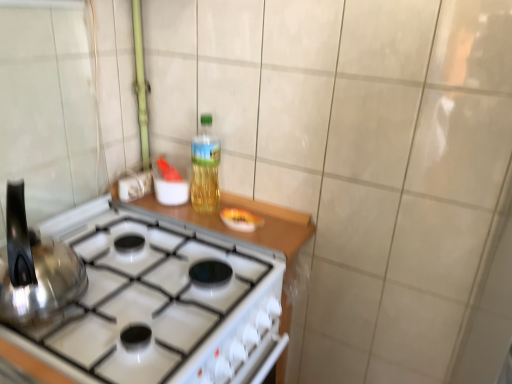
At what (x,y) coordinates should I click in order to perform the action: click on white glossy gas stove at center. Please return your answer as a coordinate pair (x, y). Image resolution: width=512 pixels, height=384 pixels. Looking at the image, I should click on (162, 309).

Locate an element on the screen. Image resolution: width=512 pixels, height=384 pixels. gas stove below the translucent plastic bottle at center (from the image's perspective) is located at coordinates 162,309.

How different are the orientations of translucent plastic bottle at center and white glossy gas stove at center in degrees?

translucent plastic bottle at center and white glossy gas stove at center are facing 2.04 degrees away from each other.

Which object is wider, translucent plastic bottle at center or white glossy gas stove at center?

Wider between the two is white glossy gas stove at center.

Measure the distance between translucent plastic bottle at center and white glossy gas stove at center.

translucent plastic bottle at center and white glossy gas stove at center are 13.06 inches apart.

Is satin silver kettle at left oriented towards translucent plastic bottle at center?

No, satin silver kettle at left is not oriented towards translucent plastic bottle at center.

How far apart are satin silver kettle at left and translucent plastic bottle at center?

satin silver kettle at left is 18.23 inches away from translucent plastic bottle at center.

Considering the relative sizes of satin silver kettle at left and translucent plastic bottle at center in the image provided, is satin silver kettle at left taller than translucent plastic bottle at center?

No.

From the image's perspective, which object appears higher, satin silver kettle at left or translucent plastic bottle at center?

From the image's view, translucent plastic bottle at center is above.

Based on the photo, are white glossy gas stove at center and translucent plastic bottle at center making contact?

No, white glossy gas stove at center is not beside translucent plastic bottle at center.

From the image's perspective, would you say white glossy gas stove at center is positioned over translucent plastic bottle at center?

No.

Is white glossy gas stove at center in front of translucent plastic bottle at center?

Yes, white glossy gas stove at center is closer to the camera.

Considering the sizes of objects white glossy gas stove at center and translucent plastic bottle at center in the image provided, who is thinner, white glossy gas stove at center or translucent plastic bottle at center?

With smaller width is translucent plastic bottle at center.

Looking at this image, is translucent plastic bottle at center not within satin silver kettle at left?

That's correct, translucent plastic bottle at center is outside of satin silver kettle at left.

Considering the points (192, 198) and (61, 245), which point is behind, point (192, 198) or point (61, 245)?

Point (192, 198)

Is translucent plastic bottle at center thinner than satin silver kettle at left?

Indeed, translucent plastic bottle at center has a lesser width compared to satin silver kettle at left.

Considering the sizes of objects translucent plastic bottle at center and satin silver kettle at left in the image provided, who is taller, translucent plastic bottle at center or satin silver kettle at left?

translucent plastic bottle at center is taller.

Does satin silver kettle at left have a smaller size compared to white glossy gas stove at center?

Yes, satin silver kettle at left is smaller than white glossy gas stove at center.

Considering the sizes of objects satin silver kettle at left and white glossy gas stove at center in the image provided, who is taller, satin silver kettle at left or white glossy gas stove at center?

white glossy gas stove at center.

From the image's perspective, is satin silver kettle at left beneath white glossy gas stove at center?

Incorrect, from the image's perspective, satin silver kettle at left is higher than white glossy gas stove at center.

In the scene shown: Is there a large distance between satin silver kettle at left and white glossy gas stove at center?

That's not correct — satin silver kettle at left is a little close to white glossy gas stove at center.

Looking at this image, can you tell me how much white glossy gas stove at center and satin silver kettle at left differ in facing direction?

The angular difference between white glossy gas stove at center and satin silver kettle at left is 0.952 degrees.

From a real-world perspective, which object stands above the other?

In real-world perspective, satin silver kettle at left is above.

Does white glossy gas stove at center lie in front of satin silver kettle at left?

No, white glossy gas stove at center is further to the viewer.

Which is closer to the camera, (156, 263) or (57, 277)?

The point (57, 277) is closer to the camera.

Image resolution: width=512 pixels, height=384 pixels. What are the coordinates of `gas stove on the left of translucent plastic bottle at center` in the screenshot? It's located at (162, 309).

Locate an element on the screen. This screenshot has width=512, height=384. bottle positioned vertically above the satin silver kettle at left (from a real-world perspective) is located at coordinates (205, 168).

Estimate the real-world distances between objects in this image. Which object is further from satin silver kettle at left, white glossy gas stove at center or translucent plastic bottle at center?

translucent plastic bottle at center.

Consider the image. Based on their spatial positions, is translucent plastic bottle at center or white glossy gas stove at center closer to satin silver kettle at left?

The object closer to satin silver kettle at left is white glossy gas stove at center.

Looking at the image, which one is located further to translucent plastic bottle at center, white glossy gas stove at center or satin silver kettle at left?

Based on the image, satin silver kettle at left appears to be further to translucent plastic bottle at center.

When comparing their distances from white glossy gas stove at center, does translucent plastic bottle at center or satin silver kettle at left seem closer?

The object closer to white glossy gas stove at center is satin silver kettle at left.

When comparing their distances from white glossy gas stove at center, does satin silver kettle at left or translucent plastic bottle at center seem further?

translucent plastic bottle at center is positioned further to the anchor white glossy gas stove at center.

Estimate the real-world distances between objects in this image. Which object is closer to translucent plastic bottle at center, satin silver kettle at left or white glossy gas stove at center?

Among the two, white glossy gas stove at center is located nearer to translucent plastic bottle at center.

Locate an element on the screen. The height and width of the screenshot is (384, 512). gas stove positioned between satin silver kettle at left and translucent plastic bottle at center from near to far is located at coordinates (162, 309).